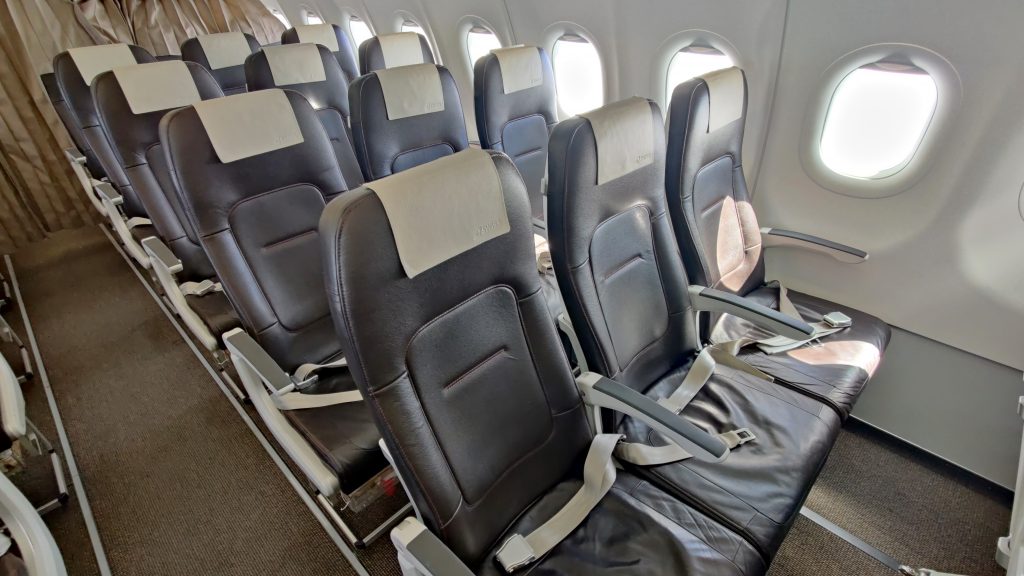
Find the location of a particular element. armrests is located at coordinates (23, 525), (15, 416), (80, 161), (111, 199), (157, 252), (252, 354), (424, 549), (652, 412), (766, 322), (826, 251).